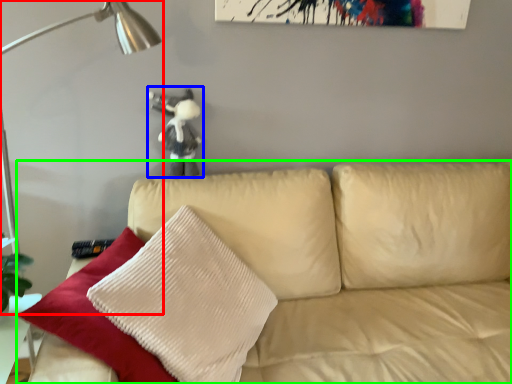
Question: Which object is the farthest from table lamp (highlighted by a red box)? Choose among these: figurine (highlighted by a blue box) or studio couch (highlighted by a green box).

Choices:
 (A) figurine
 (B) studio couch

Answer: (B)